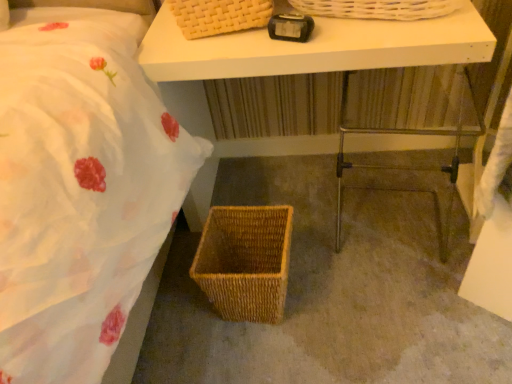
At what (x,y) coordinates should I click in order to perform the action: click on blank space above brown woven basket at lower center (from a real-world perspective). Please return your answer as a coordinate pair (x, y). This screenshot has width=512, height=384. Looking at the image, I should click on pyautogui.click(x=362, y=254).